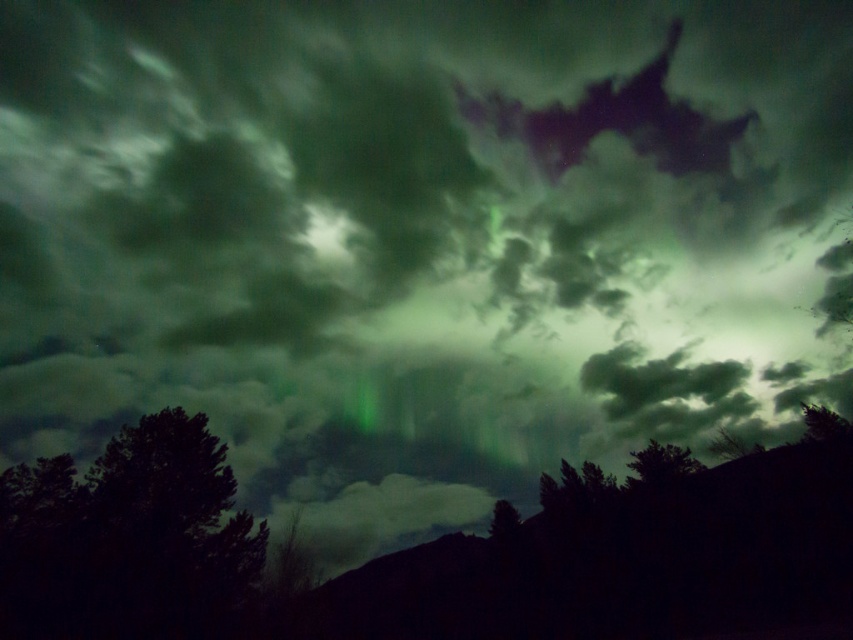
Is dark green textured tree at lower left positioned behind green matte tree at lower right?

No, dark green textured tree at lower left is in front of green matte tree at lower right.

Is dark green textured tree at lower left wider than green matte tree at lower right?

Yes, dark green textured tree at lower left is wider than green matte tree at lower right.

Between point (216, 564) and point (648, 451), which one is positioned in front?

Point (216, 564) is more forward.

At what (x,y) coordinates should I click in order to perform the action: click on dark green textured tree at lower left. Please return your answer as a coordinate pair (x, y). Looking at the image, I should click on (126, 538).

In the scene shown: Who is shorter, green matte tree at lower right or green matte tree at lower center?

With less height is green matte tree at lower center.

Is green matte tree at lower right above green matte tree at lower center?

Yes, green matte tree at lower right is above green matte tree at lower center.

Who is more distant from viewer, (650, 452) or (503, 509)?

The point (503, 509) is behind.

The image size is (853, 640). Find the location of `green matte tree at lower right`. green matte tree at lower right is located at coordinates (660, 465).

Measure the distance between green translucent cloud at center and green matte tree at lower right.

green translucent cloud at center and green matte tree at lower right are 42.79 feet apart from each other.

The image size is (853, 640). What do you see at coordinates (654, 378) in the screenshot? I see `green translucent cloud at center` at bounding box center [654, 378].

This screenshot has width=853, height=640. Describe the element at coordinates (654, 378) in the screenshot. I see `green translucent cloud at center` at that location.

Locate an element on the screen. The height and width of the screenshot is (640, 853). green translucent cloud at center is located at coordinates (654, 378).